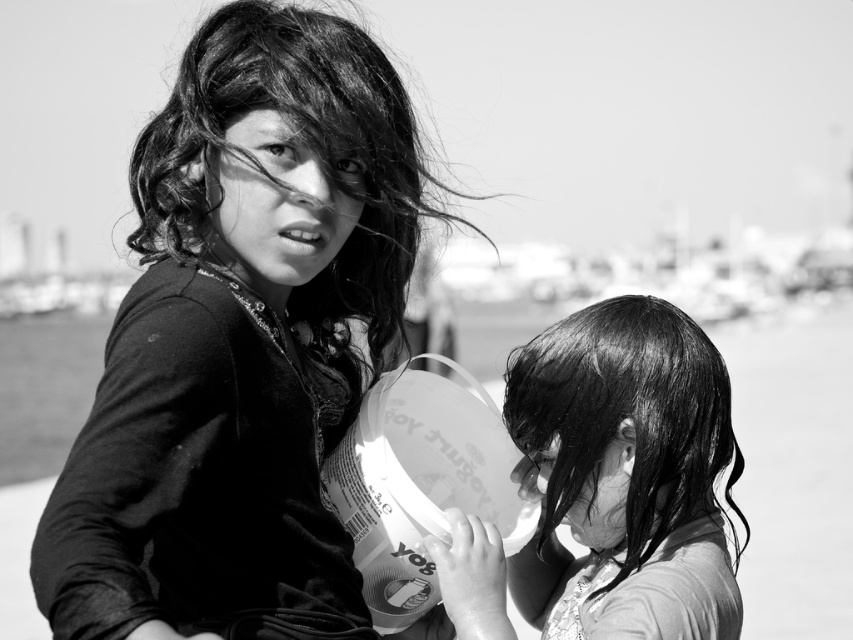
Based on the scene description, which object is closer to the viewer between the velvet black shirt at center and the wet hair at center?

The velvet black shirt at center is closer to the viewer because it is in front of the wet hair at center.

You are a photographer analyzing the composition of this black and white photo. The velvet black shirt at center and wet hair at center are both at the center of the image. Which one is positioned higher in the frame?

The velvet black shirt at center is located above wet hair at center, so it is positioned higher in the frame.